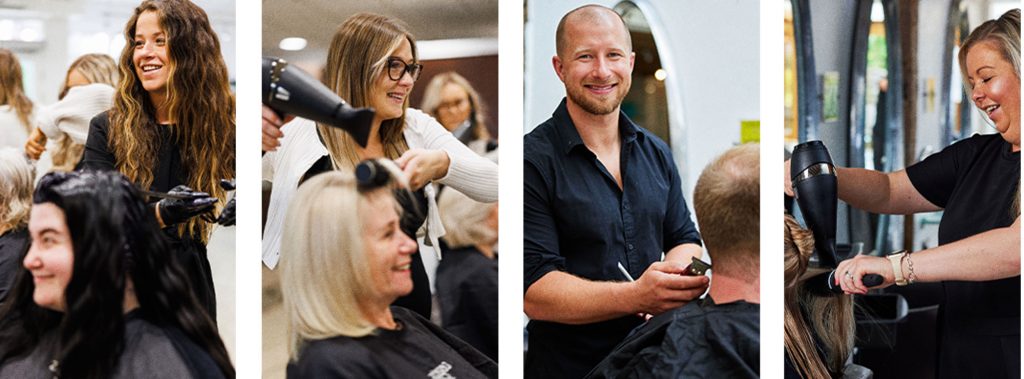
Locate an element on the screen. hairdressers is located at coordinates (975, 192), (591, 169), (416, 138), (159, 153).